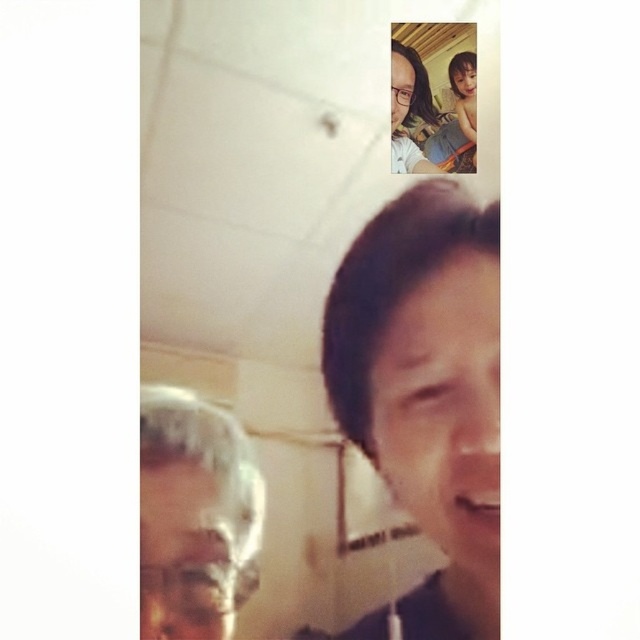
Can you confirm if smooth plastic cup at lower left is positioned to the left of matte black hair at upper right?

Yes, smooth plastic cup at lower left is to the left of matte black hair at upper right.

Can you confirm if smooth plastic cup at lower left is positioned above matte black hair at upper right?

No.

The width and height of the screenshot is (640, 640). What do you see at coordinates (182, 554) in the screenshot?
I see `smooth plastic cup at lower left` at bounding box center [182, 554].

Locate an element on the screen. smooth plastic cup at lower left is located at coordinates tap(182, 554).

Does matte black glasses at upper center have a smaller size compared to smooth skin face at upper right?

Actually, matte black glasses at upper center might be larger than smooth skin face at upper right.

Can you confirm if matte black glasses at upper center is positioned above smooth skin face at upper right?

No.

Measure the distance between point (406, 104) and camera.

Point (406, 104) is 4.28 feet away from camera.

Identify the location of matte black glasses at upper center. The image size is (640, 640). (401, 88).

Does matte skin face at center have a larger size compared to smooth plastic cup at lower left?

Correct, matte skin face at center is larger in size than smooth plastic cup at lower left.

Can you confirm if matte skin face at center is positioned to the left of smooth plastic cup at lower left?

No, matte skin face at center is not to the left of smooth plastic cup at lower left.

Is point (496, 257) positioned in front of point (220, 525)?

No, (496, 257) is behind (220, 525).

At what (x,y) coordinates should I click in order to perform the action: click on matte skin face at center. Please return your answer as a coordinate pair (x, y). Looking at the image, I should click on (444, 408).